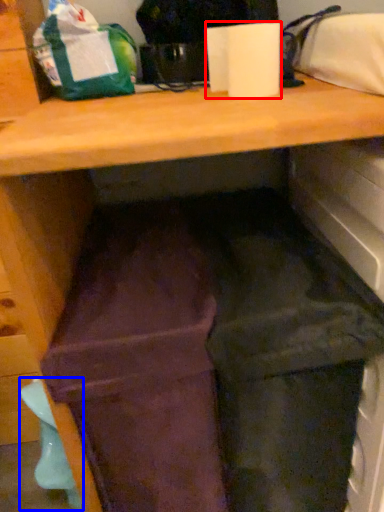
Question: Which object appears farthest to the camera in this image, paper towel (highlighted by a red box) or waste (highlighted by a blue box)?

Choices:
 (A) paper towel
 (B) waste

Answer: (B)